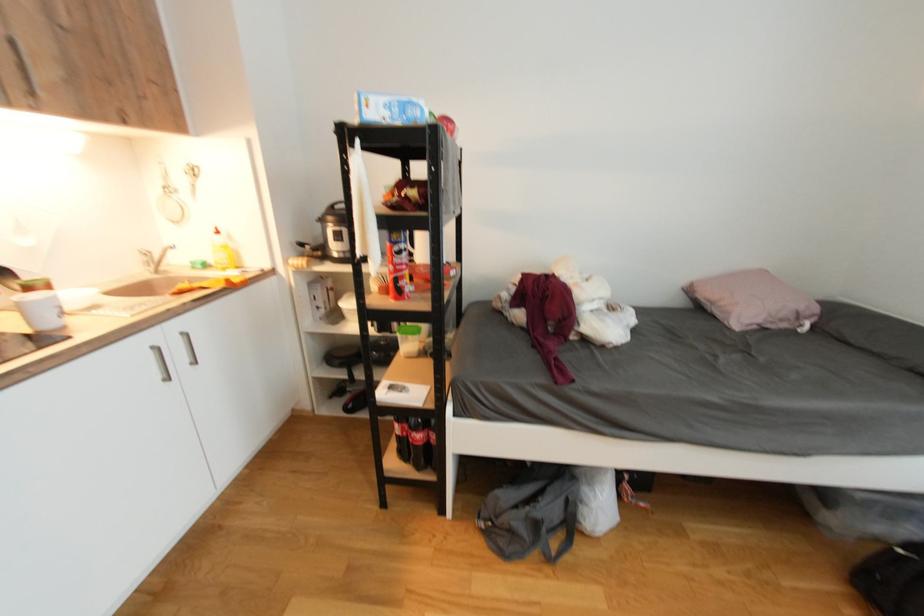
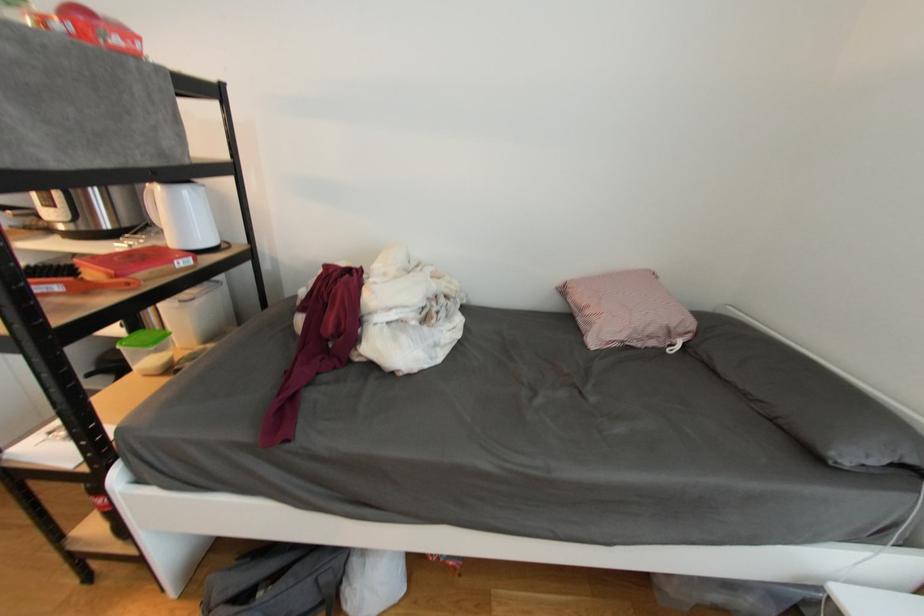
Which direction would the cameraman need to move to produce the second image?

The cameraman walked toward right, forward.